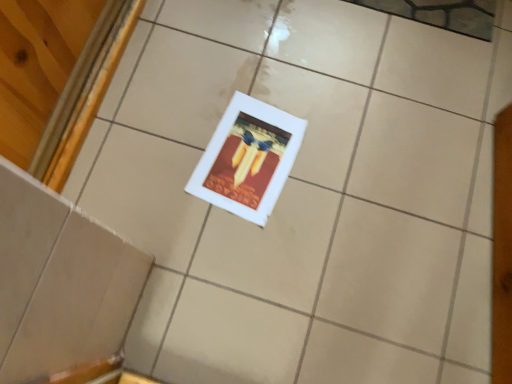
Where is `vacant region to the left of white matte picture frame at center`? vacant region to the left of white matte picture frame at center is located at coordinates (160, 142).